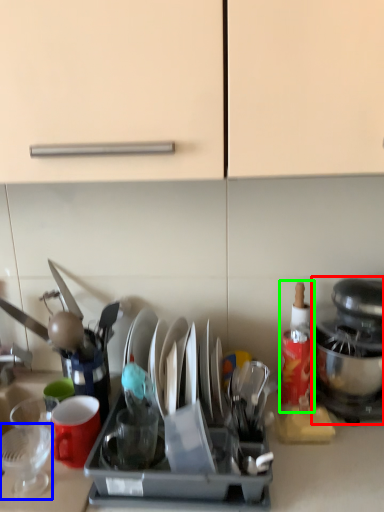
Question: Which object is positioned farthest from kitchen appliance (highlighted by a red box)? Select from tableware (highlighted by a blue box) and bottle (highlighted by a green box).

Choices:
 (A) tableware
 (B) bottle

Answer: (A)